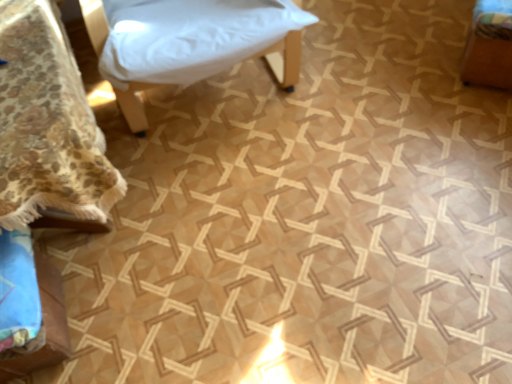
You are a GUI agent. You are given a task and a screenshot of the screen. Output one action in this format:
    pyautogui.click(x=<x>, y=<y>)
    Task: Click on the vacant space that's between blue fabric cushion at lower left, the 3th furniture from the right, and wooden box at right, which appears as the first furniture when viewed from the right
    The image size is (512, 384).
    Given the screenshot: What is the action you would take?
    pyautogui.click(x=292, y=182)